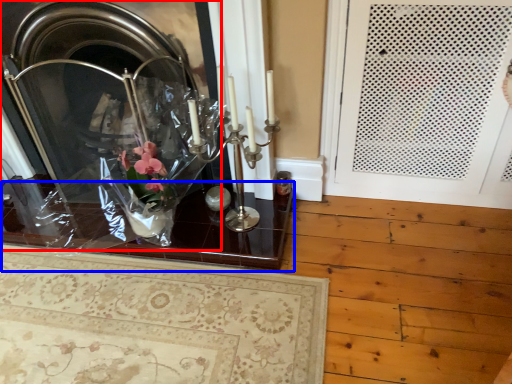
Question: Which object is closer to the camera taking this photo, fireplace (highlighted by a red box) or table (highlighted by a blue box)?

Choices:
 (A) fireplace
 (B) table

Answer: (A)